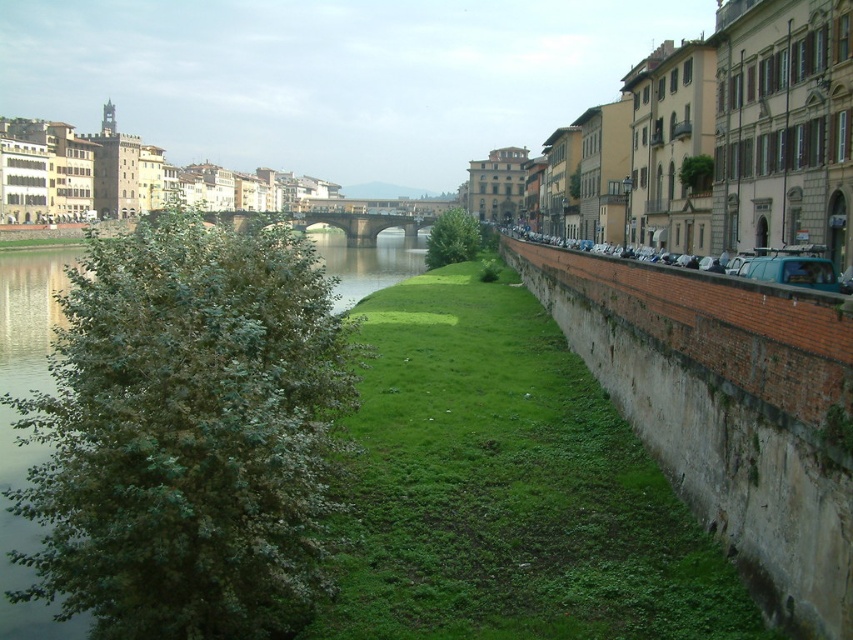
You are standing at the point marked as point (189,433) in the image. What is the nearest object to you in the scene?

The nearest object to you is the green leafy tree at left because the point is located on it.

You are standing at the riverside and want to determine which of the two points, point (32, 598) or point (672, 536), is nearer to you. Based on the scene, which point is closer?

Point (32, 598) is closer to the viewer than point (672, 536).